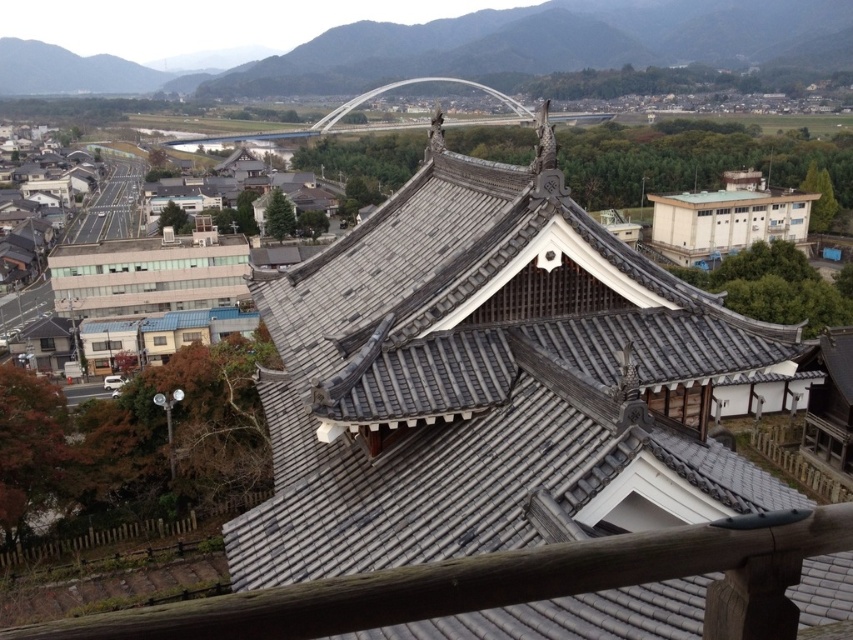
Question: Which of the following is the farthest from the observer?

Choices:
 (A) white concrete building at center-right
 (B) wooden at center

Answer: (A)

Question: Does wooden at center appear under white concrete building at center-right?

Choices:
 (A) no
 (B) yes

Answer: (B)

Question: Is gray tile roof at center wider than white concrete building at center-right?

Choices:
 (A) no
 (B) yes

Answer: (A)

Question: Which of the following is the farthest from the observer?

Choices:
 (A) wooden at center
 (B) gray stone mountain at upper center
 (C) white concrete building at center-right
 (D) gray tile roof at center

Answer: (B)

Question: Considering the real-world distances, which object is farthest from the wooden at center?

Choices:
 (A) gray stone mountain at upper center
 (B) white concrete building at center-right
 (C) gray tile roof at center

Answer: (A)

Question: From the image, what is the correct spatial relationship of gray stone mountain at upper center in relation to white concrete building at center-right?

Choices:
 (A) below
 (B) above

Answer: (B)